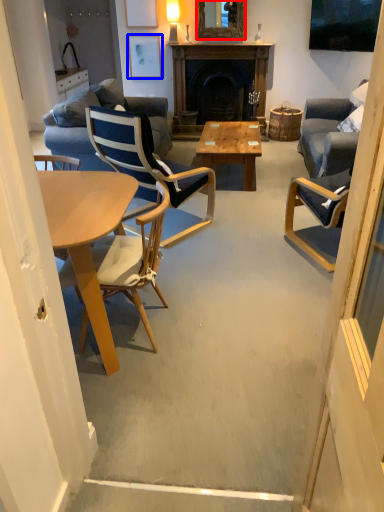
Question: Which point is closer to the camera, mirror (highlighted by a red box) or picture frame (highlighted by a blue box)?

Choices:
 (A) mirror
 (B) picture frame

Answer: (A)